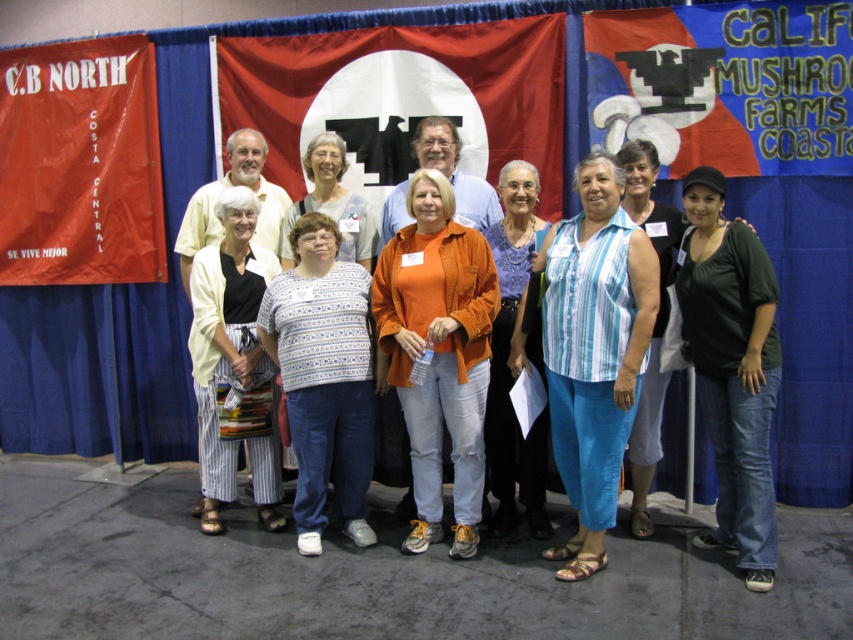
Does white printed shirt at center appear over matte black tank top at center?

No.

Between point (264, 344) and point (643, 467), which one is positioned in front?

Point (264, 344)

Who is more distant from viewer, (296, 298) or (631, 182)?

Point (631, 182)

The height and width of the screenshot is (640, 853). Find the location of `white printed shirt at center`. white printed shirt at center is located at coordinates (323, 378).

Which of these two, white printed shirt at center or matte purple blouse at center, stands taller?

With more height is matte purple blouse at center.

Does white printed shirt at center have a lesser width compared to matte purple blouse at center?

No, white printed shirt at center is not thinner than matte purple blouse at center.

Describe the element at coordinates (323, 378) in the screenshot. I see `white printed shirt at center` at that location.

The width and height of the screenshot is (853, 640). I want to click on white printed shirt at center, so click(x=323, y=378).

Is orange matte shirt at center taller than dark green jersey at center?

In fact, orange matte shirt at center may be shorter than dark green jersey at center.

Identify the location of orange matte shirt at center. This screenshot has width=853, height=640. (438, 353).

Is point (436, 189) positioned behind point (743, 488)?

Yes, it is.

Locate an element on the screen. The height and width of the screenshot is (640, 853). orange matte shirt at center is located at coordinates (438, 353).